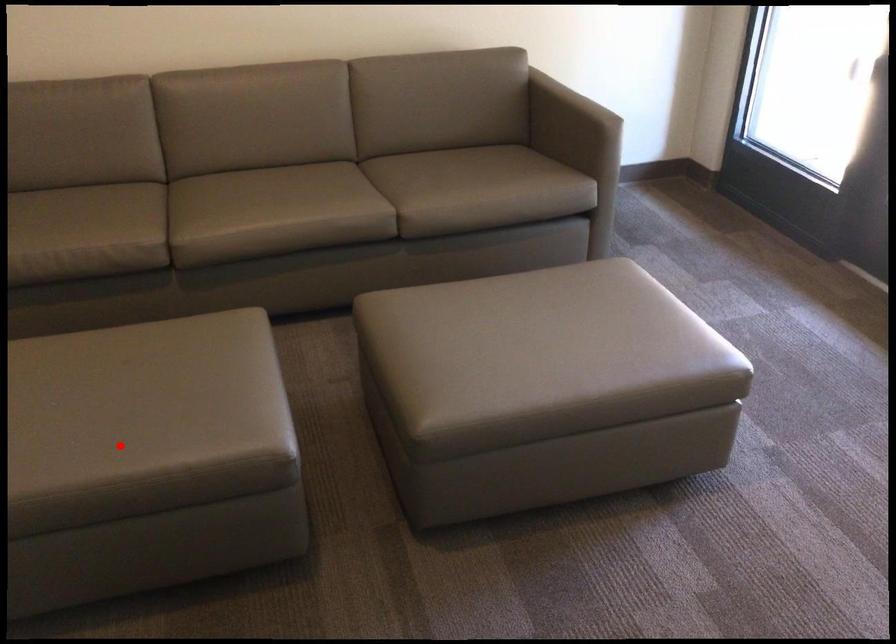
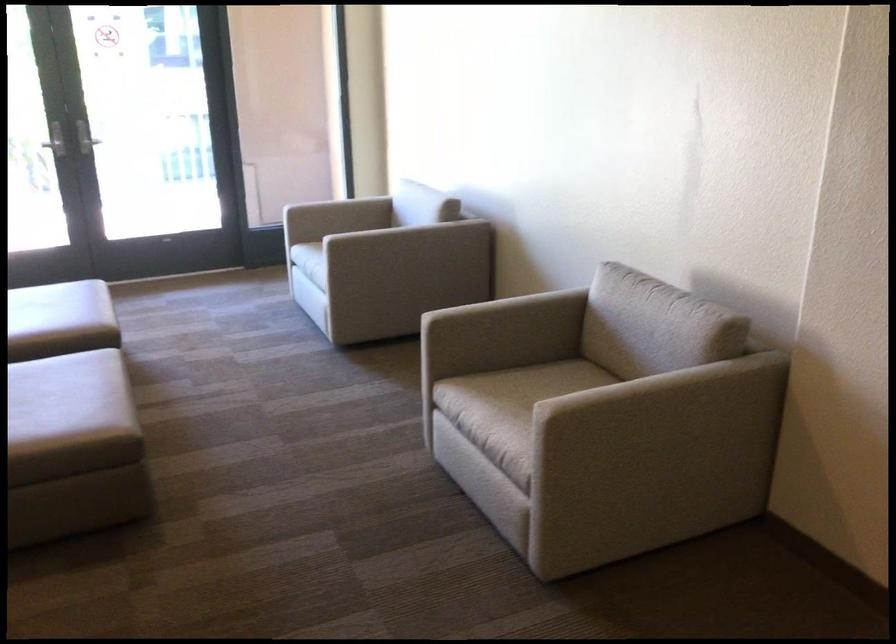
Locate, in the second image, the point that corresponds to the highlighted location in the first image.

(65, 384)